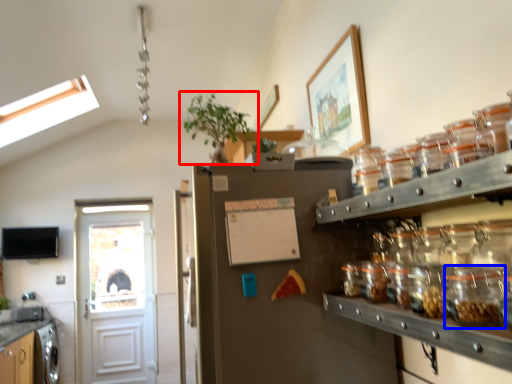
Question: Which point is closer to the camera, houseplant (highlighted by a red box) or glass jar (highlighted by a blue box)?

Choices:
 (A) houseplant
 (B) glass jar

Answer: (B)